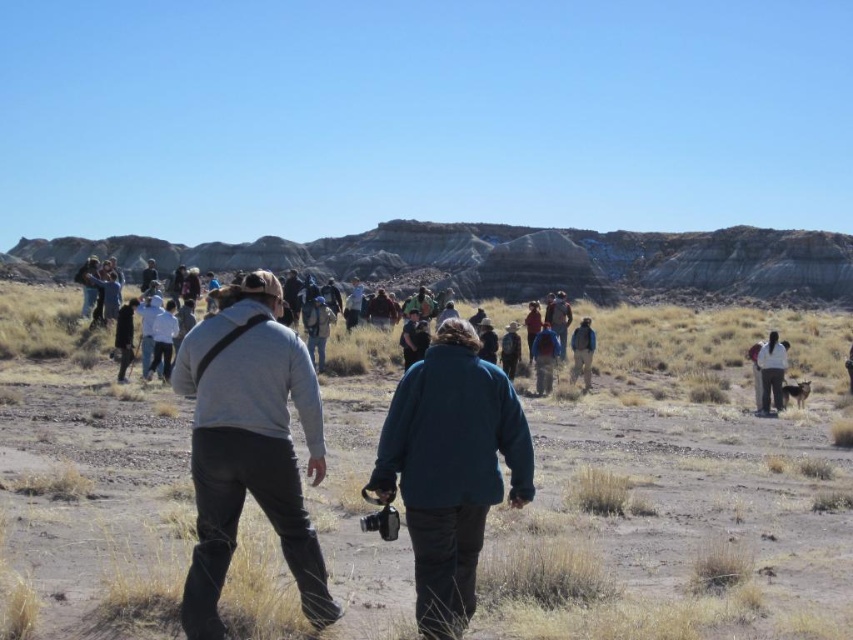
Question: Which of the following is the farthest from the observer?

Choices:
 (A) (548, 348)
 (B) (573, 342)

Answer: (B)

Question: Estimate the real-world distances between objects in this image. Which object is closer to the dark green fleece jacket at center?

Choices:
 (A) white fabric jacket at right
 (B) brown sandy dirt at center
 (C) light brown leather jacket at center

Answer: (B)

Question: Does blue denim jacket at center have a larger size compared to dark blue jacket at center?

Choices:
 (A) no
 (B) yes

Answer: (A)

Question: Can you confirm if gray fleece jacket at center is smaller than white fabric jacket at right?

Choices:
 (A) yes
 (B) no

Answer: (B)

Question: Is dark green fleece jacket at center to the left of light brown leather jacket at center from the viewer's perspective?

Choices:
 (A) no
 (B) yes

Answer: (A)

Question: Which of the following is the closest to the observer?

Choices:
 (A) (54, 522)
 (B) (758, 358)
 (C) (485, 477)
 (D) (573, 369)

Answer: (C)